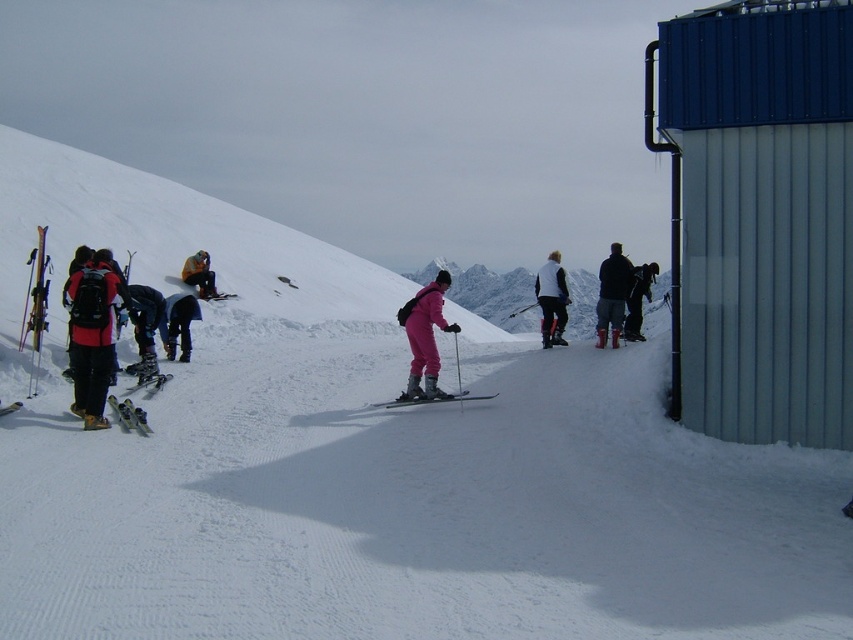
You are a photographer trying to capture a clear shot of the pink matte ski suit at center and the dark blue ski pants at left. Since you want both subjects to be in focus, which one should you focus on first?

The pink matte ski suit at center is in front of the dark blue ski pants at left. To ensure both are in focus, you should focus on the pink matte ski suit at center first, as it is closer to the camera. This will allow the dark blue ski pants at left, which are behind, to also be in focus if the depth of field is sufficient.

You are a photographer trying to capture a clear photo of the pink matte ski suit at center and the dark blue ski pants at left. Since you want both subjects to be in focus, which one should you focus on first to ensure the larger subject is sharp?

The pink matte ski suit at center is larger in size than the dark blue ski pants at left, so you should focus on the pink matte ski suit at center first to ensure it appears sharp in the photo.